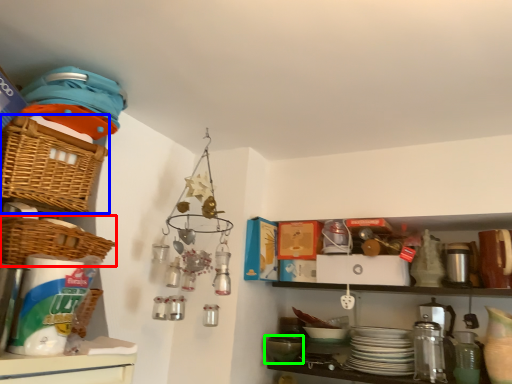
Question: Which object is positioned farthest from basket (highlighted by a red box)? Select from basket (highlighted by a blue box) and mixing bowl (highlighted by a green box).

Choices:
 (A) basket
 (B) mixing bowl

Answer: (B)